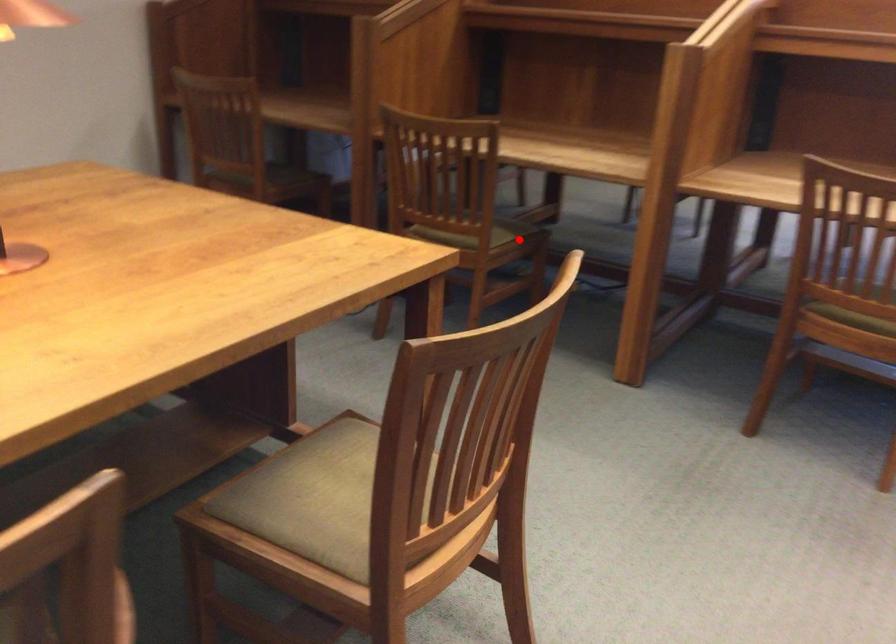
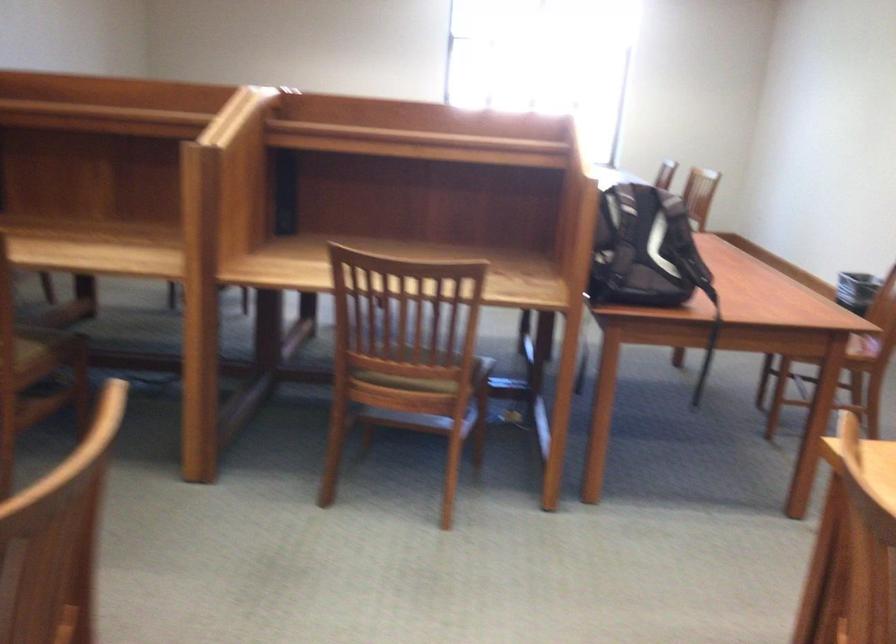
In the second image, find the point that corresponds to the highlighted location in the first image.

(46, 348)